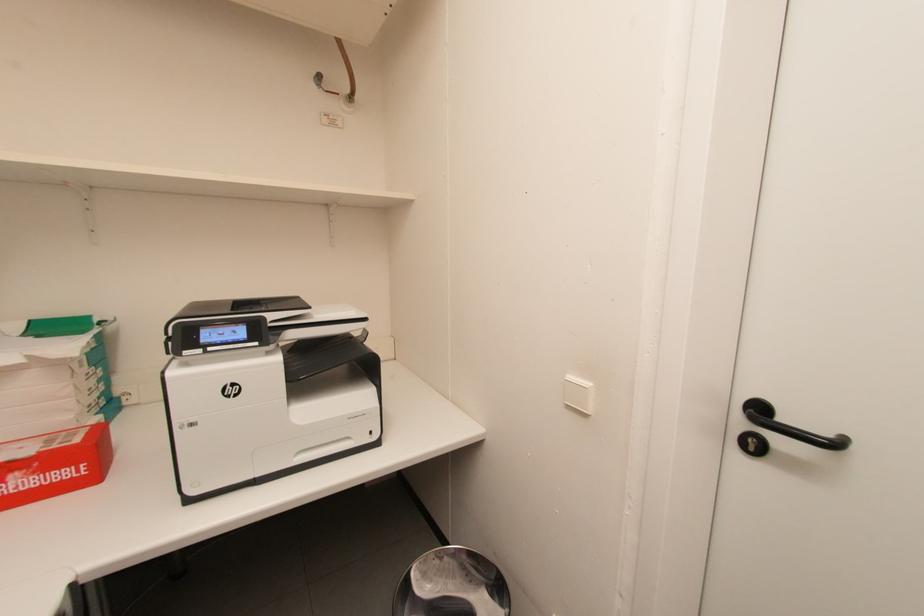
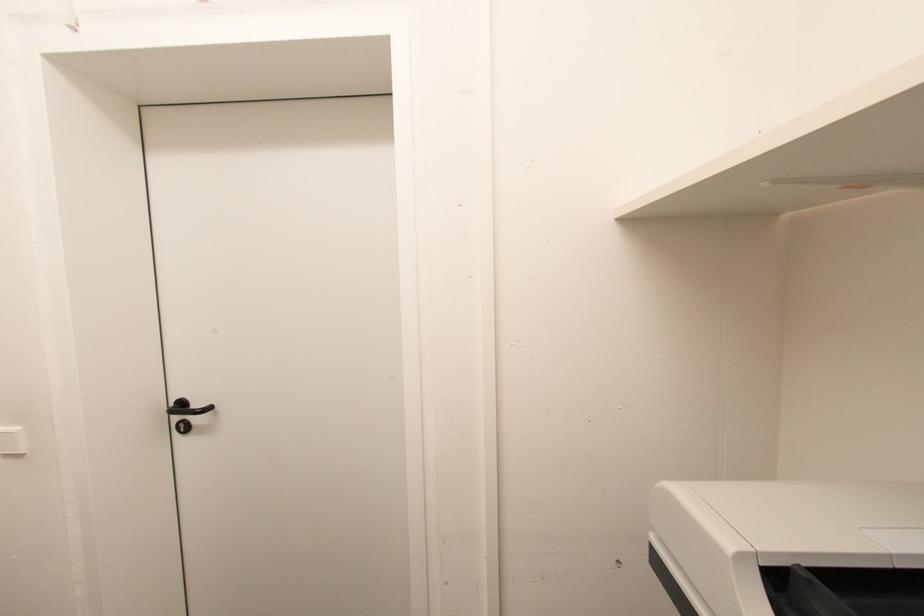
Question: How did the camera likely rotate?

Choices:
 (A) Left
 (B) Right
 (C) Up
 (D) Down

Answer: (B)